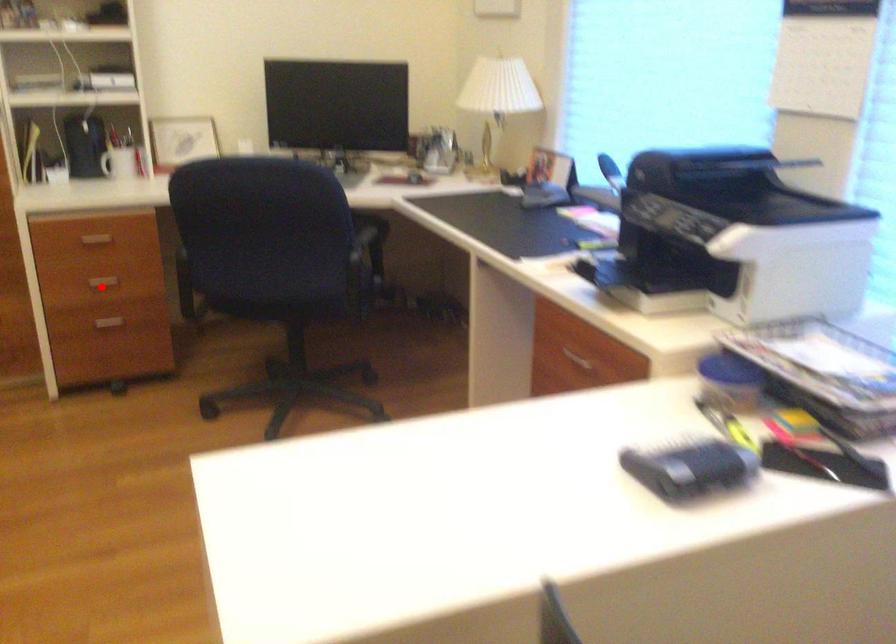
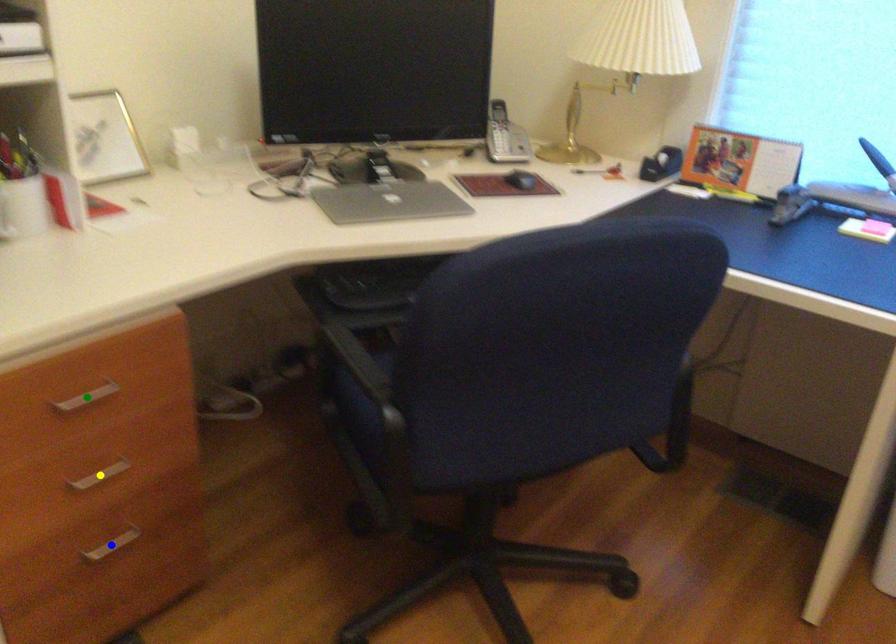
Question: I am providing you with two images of the same scene from different viewpoints. A red point is marked on the first image. You are given multiple points on the second image. Which point in image 2 represents the same 3d spot as the red point in image 1?

Choices:
 (A) green point
 (B) blue point
 (C) yellow point

Answer: (C)